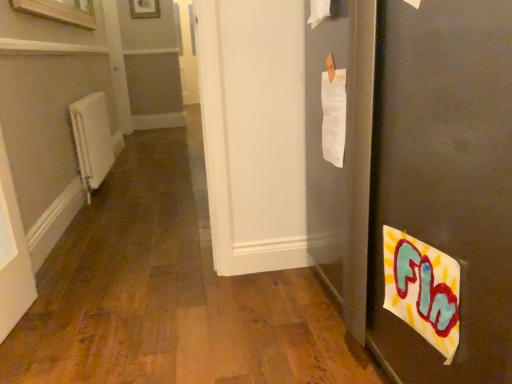
Question: Is matte black door at right outside wooden frame at upper center?

Choices:
 (A) no
 (B) yes

Answer: (B)

Question: Can you confirm if matte black door at right is bigger than wooden frame at upper center?

Choices:
 (A) no
 (B) yes

Answer: (B)

Question: Can you confirm if matte black door at right is smaller than wooden frame at upper center?

Choices:
 (A) yes
 (B) no

Answer: (B)

Question: Is the position of matte black door at right less distant than that of wooden frame at upper center?

Choices:
 (A) yes
 (B) no

Answer: (A)

Question: Is matte black door at right looking in the opposite direction of wooden frame at upper center?

Choices:
 (A) no
 (B) yes

Answer: (A)

Question: In the image, is wooden frame at upper center on the left side or the right side of matte black door at right?

Choices:
 (A) left
 (B) right

Answer: (A)

Question: Which is correct: wooden frame at upper center is inside matte black door at right, or outside of it?

Choices:
 (A) outside
 (B) inside

Answer: (A)

Question: Is point (137, 1) closer or farther from the camera than point (471, 99)?

Choices:
 (A) farther
 (B) closer

Answer: (A)

Question: Based on their sizes in the image, would you say wooden frame at upper center is bigger or smaller than matte black door at right?

Choices:
 (A) small
 (B) big

Answer: (A)

Question: Considering the positions of wooden frame at upper center and white matte radiator at left in the image, is wooden frame at upper center taller or shorter than white matte radiator at left?

Choices:
 (A) short
 (B) tall

Answer: (A)

Question: From a real-world perspective, relative to white matte radiator at left, is wooden frame at upper center vertically above or below?

Choices:
 (A) above
 (B) below

Answer: (A)

Question: Considering their positions, is wooden frame at upper center located in front of or behind white matte radiator at left?

Choices:
 (A) behind
 (B) front

Answer: (A)

Question: Considering the positions of wooden frame at upper center and white matte radiator at left in the image, is wooden frame at upper center wider or thinner than white matte radiator at left?

Choices:
 (A) wide
 (B) thin

Answer: (B)

Question: In the image, is matte black door at right positioned in front of or behind wooden frame at upper center?

Choices:
 (A) behind
 (B) front

Answer: (B)

Question: In terms of size, does matte black door at right appear bigger or smaller than wooden frame at upper center?

Choices:
 (A) small
 (B) big

Answer: (B)